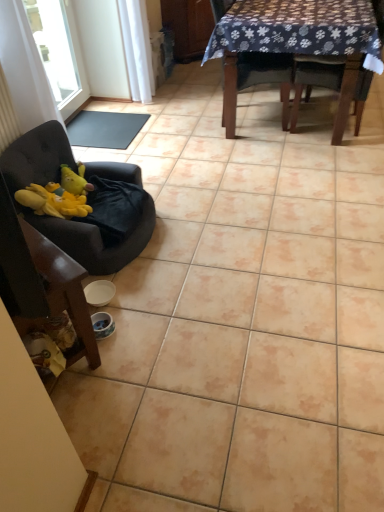
At what (x,y) coordinates should I click in order to perform the action: click on vacant space to the right of velvet dark brown armchair at left, placed as the first chair when sorted from left to right. Please return your answer as a coordinate pair (x, y). Looking at the image, I should click on (148, 340).